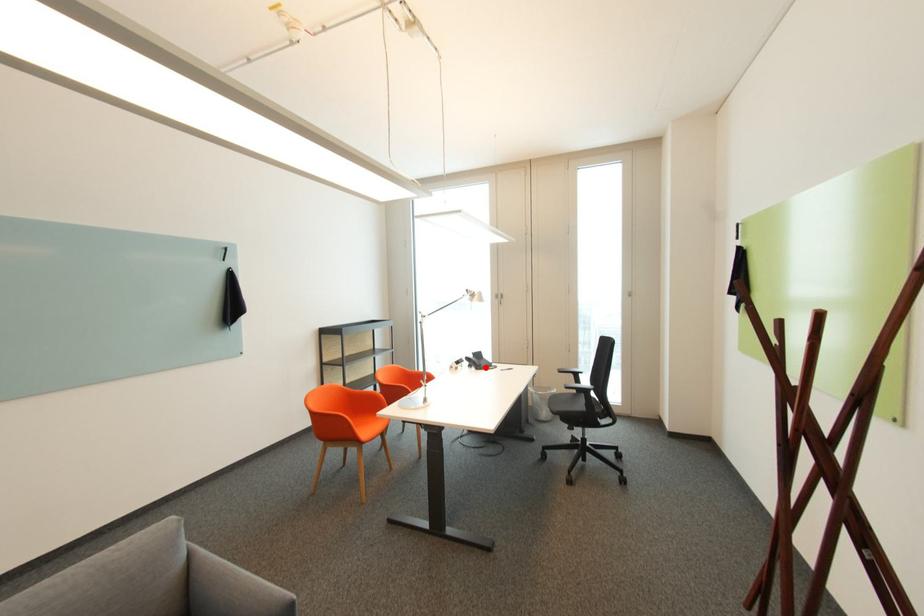
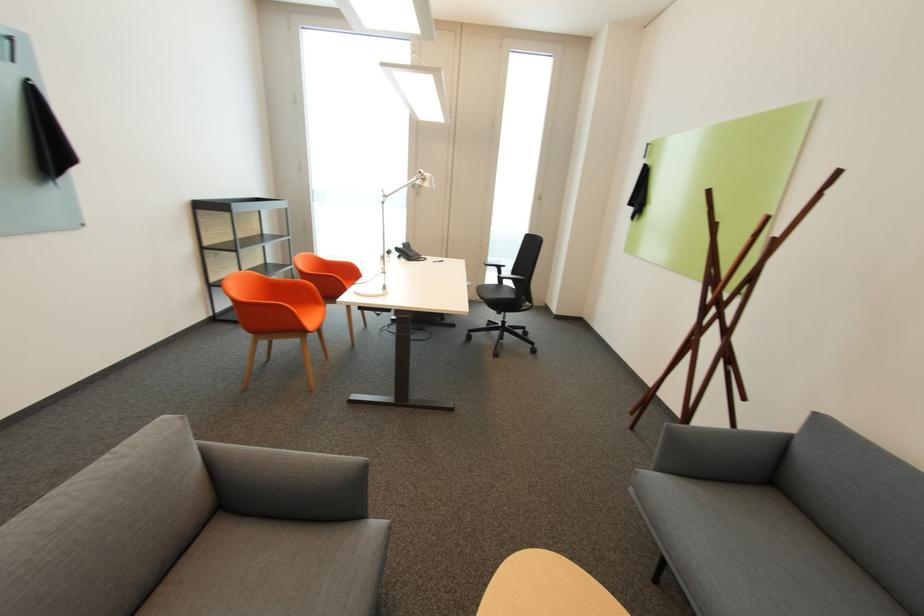
Question: I am providing you with two images of the same scene from different viewpoints. Given a red point in image1, look at the same physical point in image2. Is it:

Choices:
 (A) Closer to the viewpoint
 (B) Farther from the viewpoint

Answer: (A)